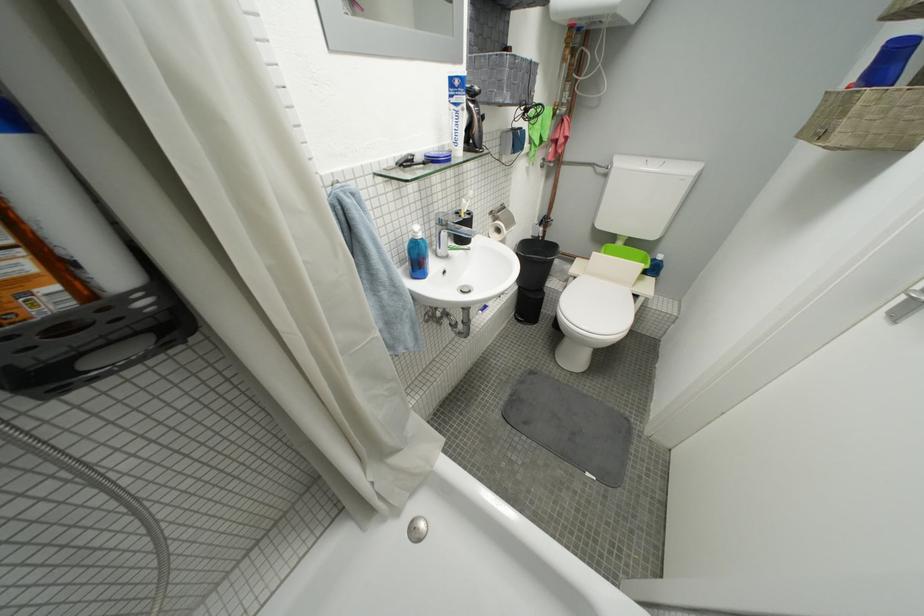
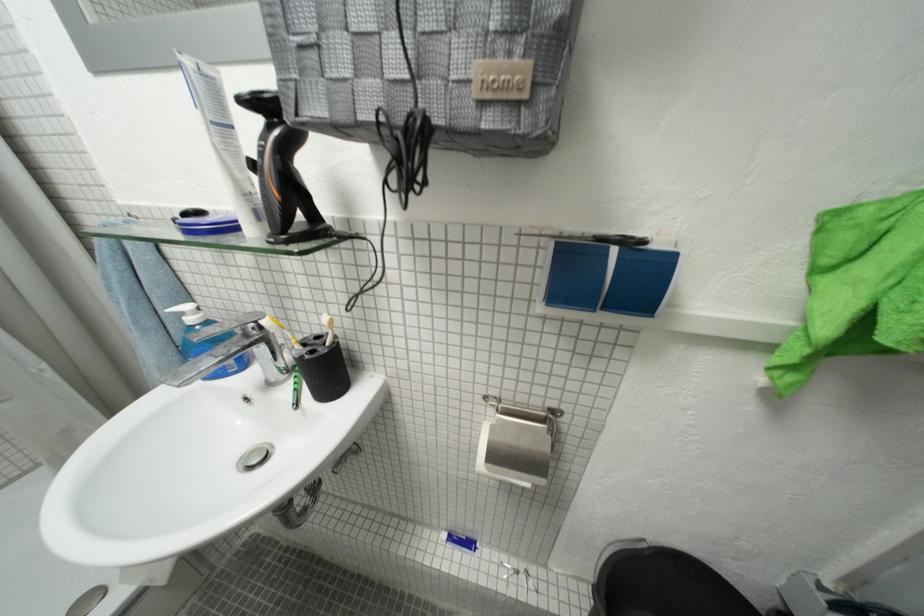
Where in the second image is the point corresponding to point 489,314 from the first image?

(454, 538)